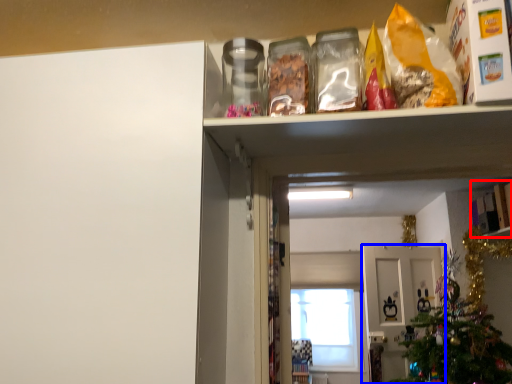
Question: Which object appears farthest to the camera in this image, cabinet (highlighted by a red box) or door (highlighted by a blue box)?

Choices:
 (A) cabinet
 (B) door

Answer: (B)